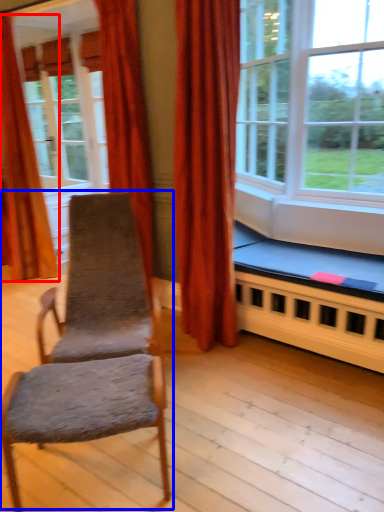
Question: Which point is closer to the camera, curtain (highlighted by a red box) or rocking chair (highlighted by a blue box)?

Choices:
 (A) curtain
 (B) rocking chair

Answer: (B)